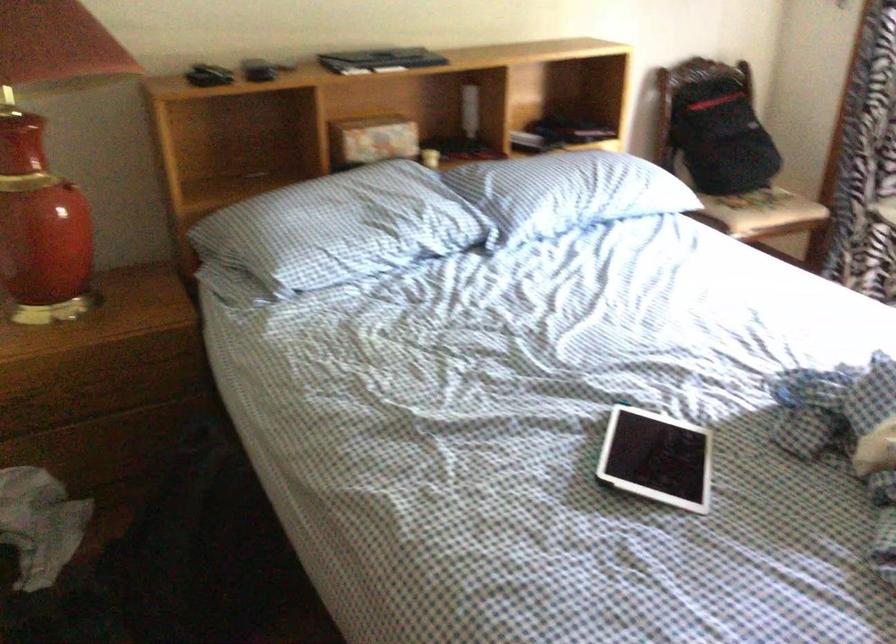
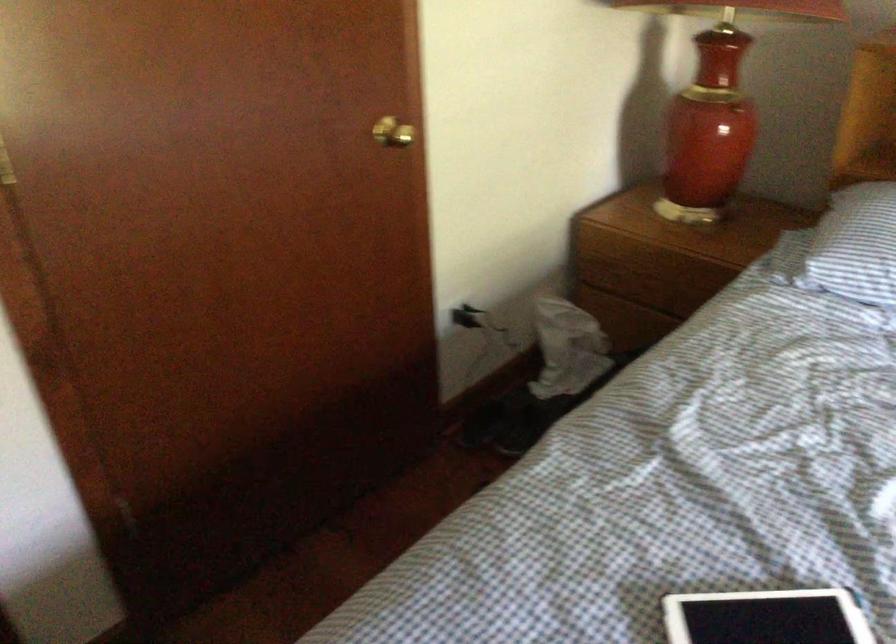
Where in the second image is the point corresponding to point (95, 391) from the first image?

(650, 283)